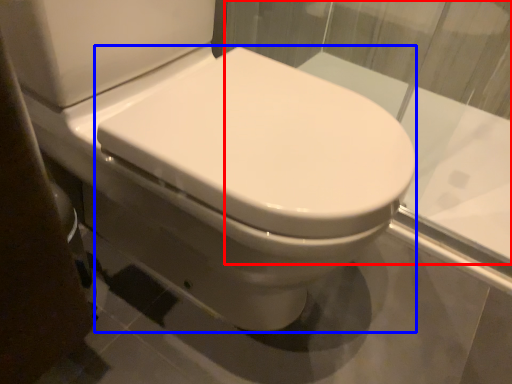
Question: Which of the following is the farthest to the observer, glass window (highlighted by a red box) or bidet (highlighted by a blue box)?

Choices:
 (A) glass window
 (B) bidet

Answer: (A)